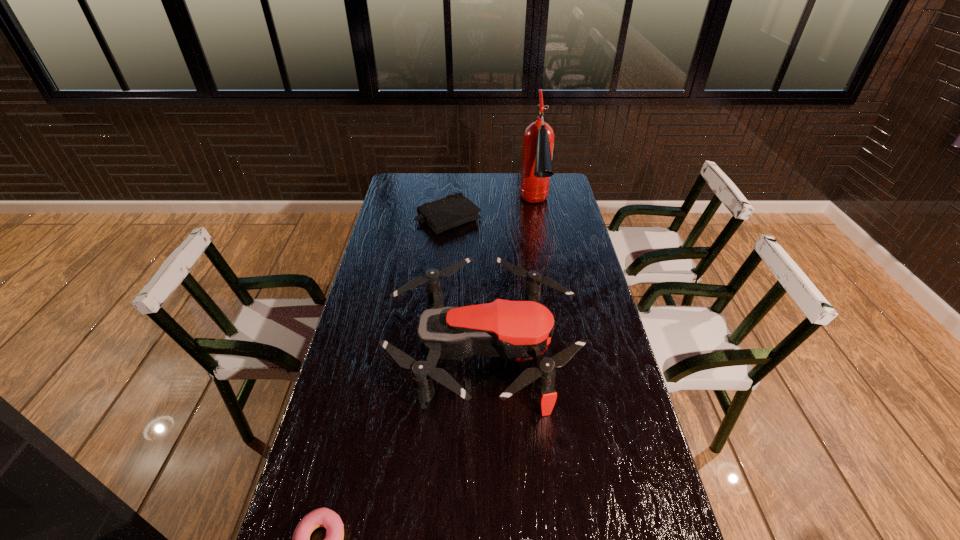
Identify the location of fire extinguisher. The height and width of the screenshot is (540, 960). (538, 138).

The image size is (960, 540). I want to click on drone, so 521,330.

Find the location of a particular element. The height and width of the screenshot is (540, 960). the fourth shortest object is located at coordinates (521, 330).

I want to click on Bible, so click(x=454, y=210).

You are a GUI agent. You are given a task and a screenshot of the screen. Output one action in this format:
    pyautogui.click(x=<x>, y=<y>)
    Task: Click on the vacant region located at the nozzle end of the fire extinguisher
    
    Given the screenshot: What is the action you would take?
    pyautogui.click(x=541, y=241)

Where is `vacant space positioned 0.090m on the right of the Bible`? vacant space positioned 0.090m on the right of the Bible is located at coordinates (501, 218).

At what (x,y) coordinates should I click in order to perform the action: click on object that is at the far edge. Please return your answer as a coordinate pair (x, y). Image resolution: width=960 pixels, height=540 pixels. Looking at the image, I should click on (538, 138).

Identify the location of drone at the left edge. The image size is (960, 540). (521, 330).

The width and height of the screenshot is (960, 540). Find the location of `Bible at the left edge`. Bible at the left edge is located at coordinates (454, 210).

The height and width of the screenshot is (540, 960). Find the location of `fire extinguisher that is at the right edge`. fire extinguisher that is at the right edge is located at coordinates (538, 138).